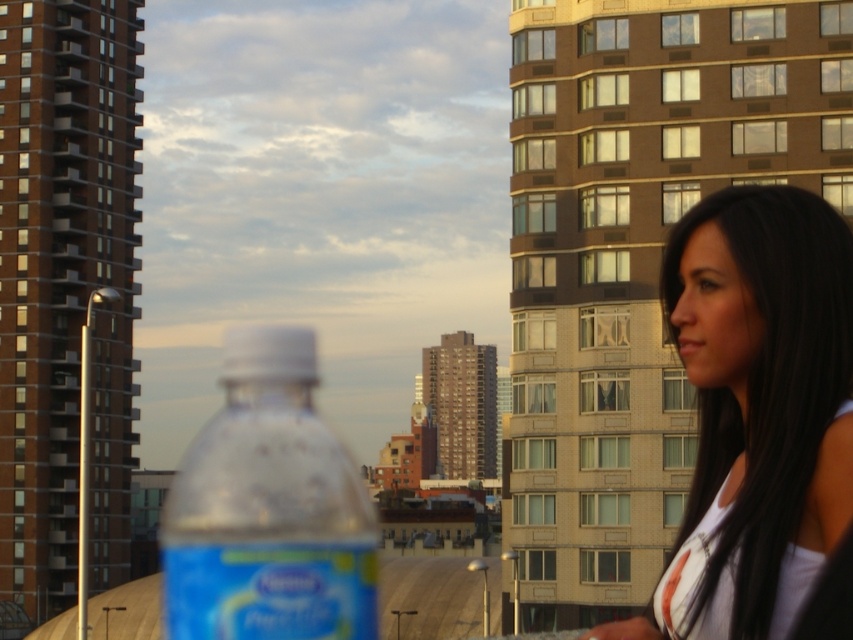
You are standing in a city park and see a person wearing a smooth white tank top at right. If you want to take a photo of them without using a zoom lens, will they be in focus if you focus on the plastic water bottle with a blue label in the lower left?

The smooth white tank top at right is 9.93 meters away from the camera. Since the plastic water bottle with a blue label in the lower left is in focus, and the tank top is significantly farther away, it may not be in focus unless the depth of field is very large. However, without knowing the exact depth of field, it is uncertain. But given typical camera settings, focusing on the closer bottle might leave the distant tank top slightly out of focus.

You are a photographer trying to capture the translucent plastic bottle at center. You notice the smooth white tank top at right is blocking your view. Can you move the tank top to get a clear shot of the bottle?

The smooth white tank top at right is closer to the viewer than the translucent plastic bottle at center, so moving the tank top would allow you to see the translucent plastic bottle at center without obstruction.

You are a photographer who wants to capture the smooth white tank top at right in the cityscape. Based on the scene description, where should you position your camera to ensure it is in focus, considering the plastic water bottle with a blue label in the lower left is already in focus?

To capture the smooth white tank top at right in focus, position the camera so that the focus point aligns with its coordinates at (763, 396). Since the plastic water bottle with a blue label in the lower left is already in focus, adjust the focus to the tank top at right by moving the focus point to its specified coordinates.